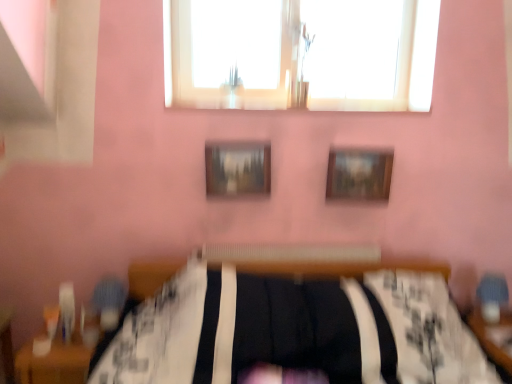
This screenshot has width=512, height=384. In order to click on empty space that is ontop of wooden table at lower left, positioned as the 1th table in left-to-right order (from a real-world perspective) in this screenshot , I will do `click(79, 331)`.